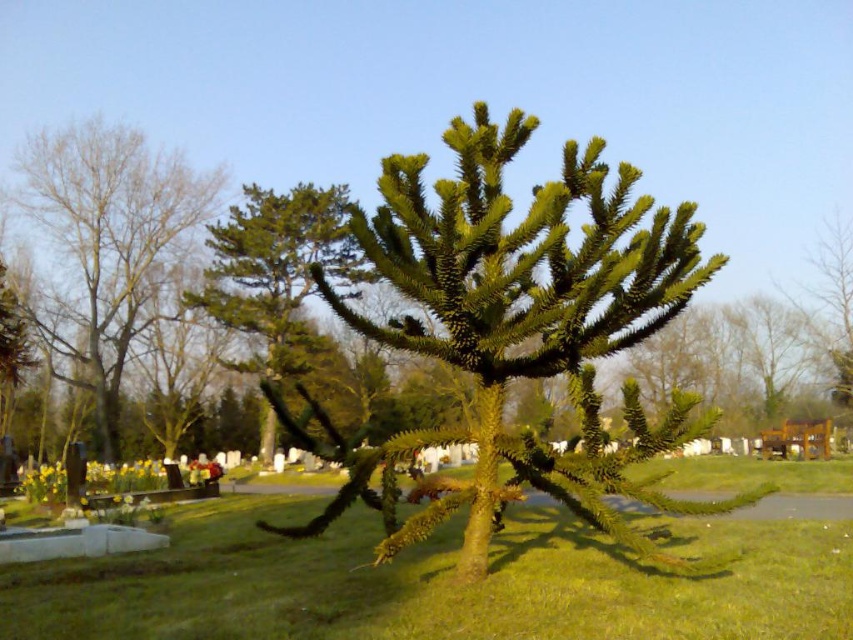
Which is above, green grass at center or green spiky tree at left?

green spiky tree at left is higher up.

Between green grass at center and green spiky tree at left, which one appears on the left side from the viewer's perspective?

green spiky tree at left

Is point (328, 588) more distant than point (114, 310)?

That is False.

What are the coordinates of `green grass at center` in the screenshot? It's located at (436, 582).

Does green spiky tree at left have a greater width compared to green textured pine tree at upper left?

Yes.

Does green spiky tree at left have a smaller size compared to green textured pine tree at upper left?

No.

Does point (148, 292) come in front of point (273, 193)?

Yes, it is in front of point (273, 193).

In order to click on green spiky tree at left in this screenshot , I will do `click(107, 248)`.

Is green spiky tree at center to the right of green spiky tree at left from the viewer's perspective?

Correct, you'll find green spiky tree at center to the right of green spiky tree at left.

What do you see at coordinates (521, 332) in the screenshot?
I see `green spiky tree at center` at bounding box center [521, 332].

Find the location of `green spiky tree at center`. green spiky tree at center is located at coordinates 521,332.